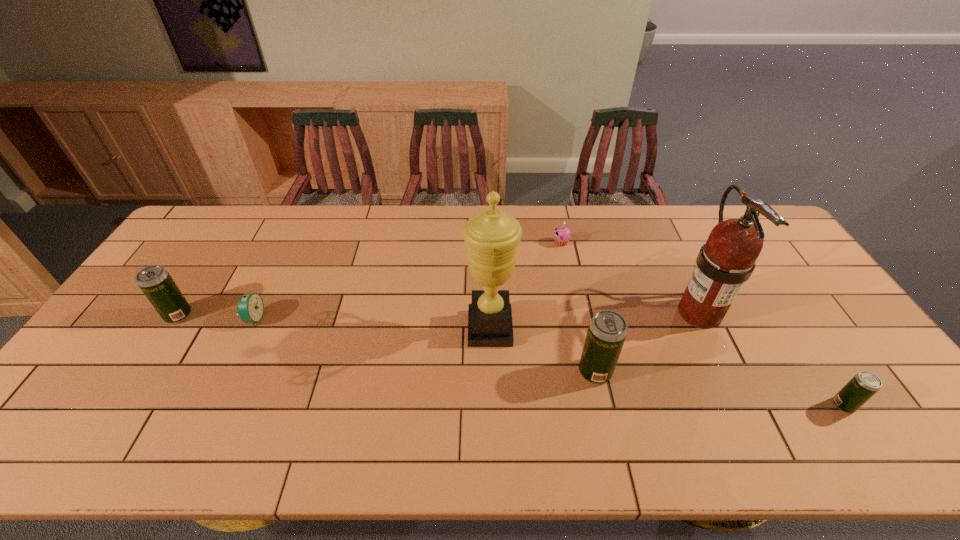
Identify which object is the fifth nearest to the farthest object. Please provide its 2D coordinates. Your answer should be formatted as a tuple, i.e. [(x, y)], where the tuple contains the x and y coordinates of a point satisfying the conditions above.

[(250, 307)]

The width and height of the screenshot is (960, 540). I want to click on object that is the closest to the second object from left to right, so click(x=156, y=283).

Select which beer can appears as the third closest to the alarm clock. Please provide its 2D coordinates. Your answer should be formatted as a tuple, i.e. [(x, y)], where the tuple contains the x and y coordinates of a point satisfying the conditions above.

[(865, 384)]

Point out which beer can is positioned as the second nearest to the shortest beer can. Please provide its 2D coordinates. Your answer should be formatted as a tuple, i.e. [(x, y)], where the tuple contains the x and y coordinates of a point satisfying the conditions above.

[(156, 283)]

Where is `vacant region that satisfies the following two spatial constraints: 1. at the nozzle of the second object from right to left; 2. on the left side of the fifth tallest object`? The height and width of the screenshot is (540, 960). vacant region that satisfies the following two spatial constraints: 1. at the nozzle of the second object from right to left; 2. on the left side of the fifth tallest object is located at coordinates (743, 405).

Where is `free spot that satisfies the following two spatial constraints: 1. at the front of the trophy cup with handles; 2. on the left side of the fifth tallest object`? This screenshot has height=540, width=960. free spot that satisfies the following two spatial constraints: 1. at the front of the trophy cup with handles; 2. on the left side of the fifth tallest object is located at coordinates (492, 405).

Image resolution: width=960 pixels, height=540 pixels. I want to click on free region that satisfies the following two spatial constraints: 1. at the nozzle of the fire extinguisher; 2. on the left side of the rightmost beer can, so click(743, 405).

At what (x,y) coordinates should I click in order to perform the action: click on free space that satisfies the following two spatial constraints: 1. on the back side of the fifth tallest object; 2. on the front-facing side of the sixth object from right to left. Please return your answer as a coordinate pair (x, y). This screenshot has width=960, height=540. Looking at the image, I should click on (786, 318).

Locate an element on the screen. vacant space that satisfies the following two spatial constraints: 1. on the front-facing side of the second beer can from right to left; 2. on the right side of the sixth object from right to left is located at coordinates (228, 372).